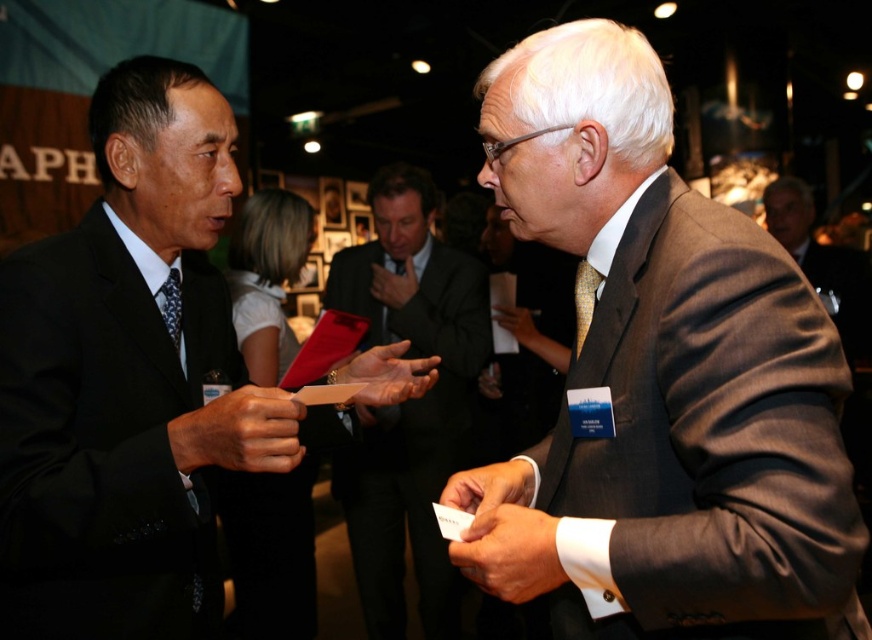
You are a photographer at a formal event. You need to capture a photo of the gray suit at right and the matte black tie at left. Which object should you focus on first if you want to ensure both are in frame without moving the camera?

The gray suit at right is wider than the matte black tie at left, so you should focus on the gray suit at right first to ensure it fits within the frame before adjusting for the matte black tie at left.

You are at a formal event and see two men. One is wearing a matte black suit at left, and the other is wearing a gray suit at right. Which one is positioned more to the left side of the scene?

The matte black suit at left is positioned more to the left side of the scene compared to the gray suit at right.

You are taking a photo of two men at a formal event. You want to focus on the man holding a white card. Which of the two points, point (x=51, y=616) or point (x=179, y=339), is closer to the camera and thus better for focusing on the man with the white card?

Point (x=51, y=616) is closer to the camera than point (x=179, y=339), so it is better for focusing on the man with the white card.